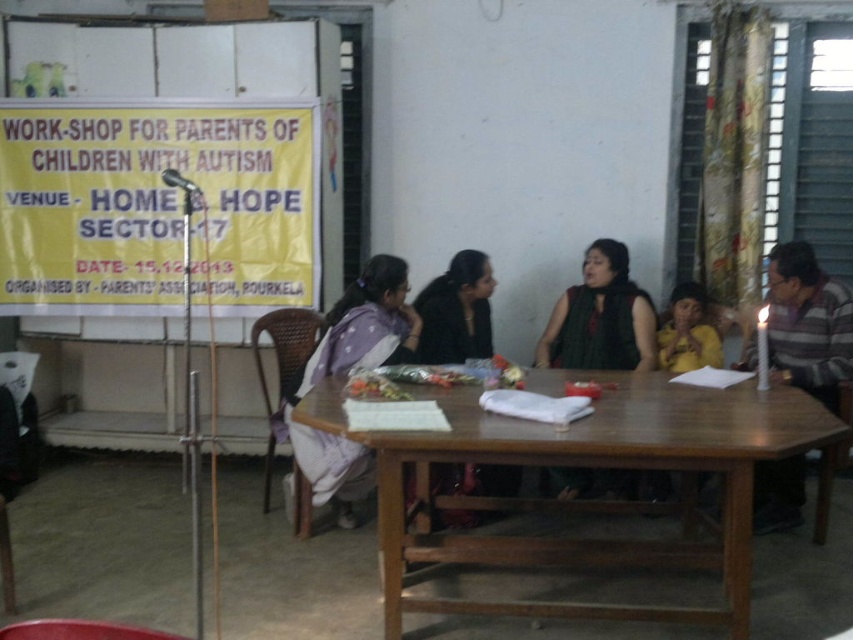
Measure the distance between point (473, 451) and camera.

A distance of 8.63 feet exists between point (473, 451) and camera.

Does point (469, 534) lie behind point (602, 490)?

No, (469, 534) is closer to viewer.

Based on the photo, measure the distance between point (550, 538) and camera.

Point (550, 538) and camera are 10.64 feet apart.

Where is `brown wooden table at center`? brown wooden table at center is located at coordinates (584, 500).

Between point (306, 380) and point (433, 349), which one is positioned in front?

Point (306, 380) is in front.

Does point (358, 305) come in front of point (473, 516)?

That is True.

The width and height of the screenshot is (853, 640). I want to click on purple fabric at center, so click(x=346, y=372).

Which is more to the left, purple fabric at center or green matte scarf at center?

purple fabric at center is more to the left.

Who is positioned more to the right, purple fabric at center or green matte scarf at center?

green matte scarf at center

Locate an element on the screen. The image size is (853, 640). purple fabric at center is located at coordinates (346, 372).